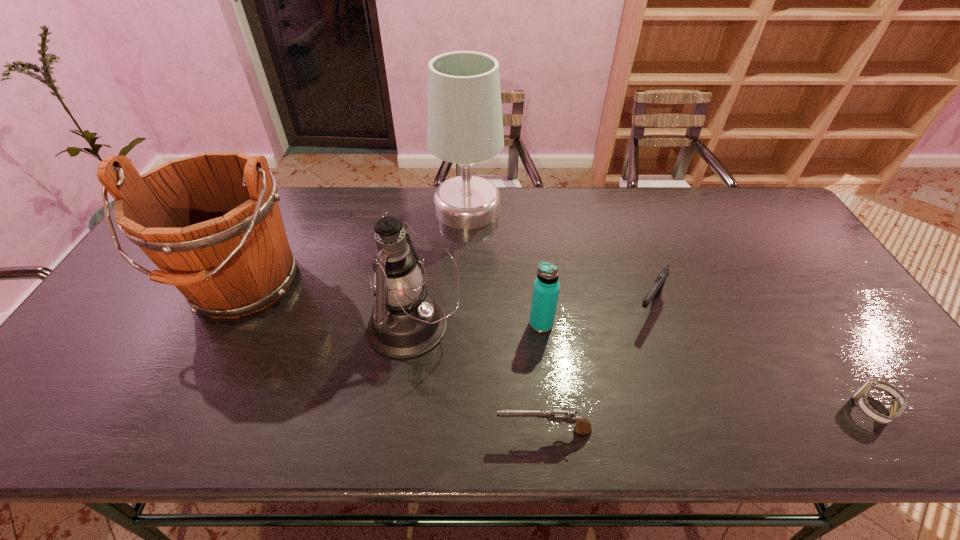
What are the coordinates of `vacant space located on the face of the watch` in the screenshot? It's located at (731, 408).

You are a GUI agent. You are given a task and a screenshot of the screen. Output one action in this format:
    pyautogui.click(x=<x>, y=<y>)
    Task: Click on the free space located on the face of the watch
    The width and height of the screenshot is (960, 540).
    Given the screenshot: What is the action you would take?
    pyautogui.click(x=811, y=408)

You are a GUI agent. You are given a task and a screenshot of the screen. Output one action in this format:
    pyautogui.click(x=<x>, y=<y>)
    Task: Click on the object located at the far edge
    
    Given the screenshot: What is the action you would take?
    pyautogui.click(x=465, y=126)

What are the coordinates of `gun that is at the near edge` in the screenshot? It's located at (583, 426).

Find the location of a particular element. This screenshot has height=540, width=960. watch that is at the near edge is located at coordinates (897, 406).

What are the coordinates of `object that is at the left edge` in the screenshot? It's located at (211, 223).

The width and height of the screenshot is (960, 540). Identify the location of object that is at the right edge. (897, 406).

At what (x,y) coordinates should I click in order to perform the action: click on object present at the near right corner. Please return your answer as a coordinate pair (x, y). Looking at the image, I should click on (897, 406).

This screenshot has height=540, width=960. I want to click on vacant area at the far edge of the desktop, so click(x=723, y=227).

Where is `vacant area at the near edge of the desktop`? vacant area at the near edge of the desktop is located at coordinates (751, 427).